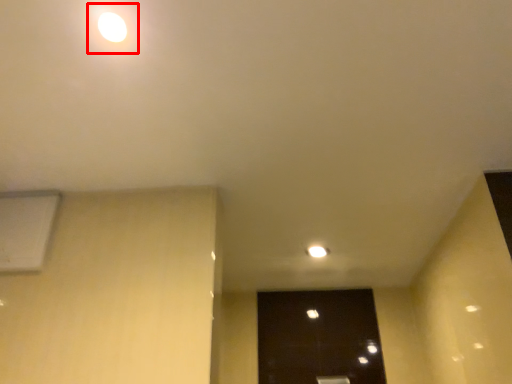
Question: From the image, what is the correct spatial relationship of light (annotated by the red box) in relation to air conditioning?

Choices:
 (A) left
 (B) right

Answer: (B)